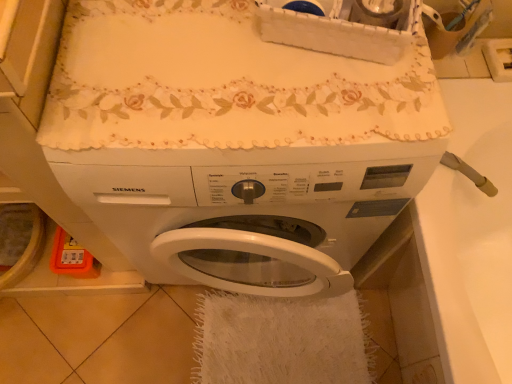
Question: From a real-world perspective, is white glossy sink at right positioned above or below white matte washing machine at center?

Choices:
 (A) above
 (B) below

Answer: (B)

Question: From the image's perspective, is white glossy sink at right positioned above or below white matte washing machine at center?

Choices:
 (A) above
 (B) below

Answer: (B)

Question: Which object is the closest to the white glossy sink at right?

Choices:
 (A) white fluffy bath towel at lower center
 (B) white matte washing machine at center

Answer: (B)

Question: Estimate the real-world distances between objects in this image. Which object is closer to the white matte washing machine at center?

Choices:
 (A) white glossy sink at right
 (B) white fluffy bath towel at lower center

Answer: (A)